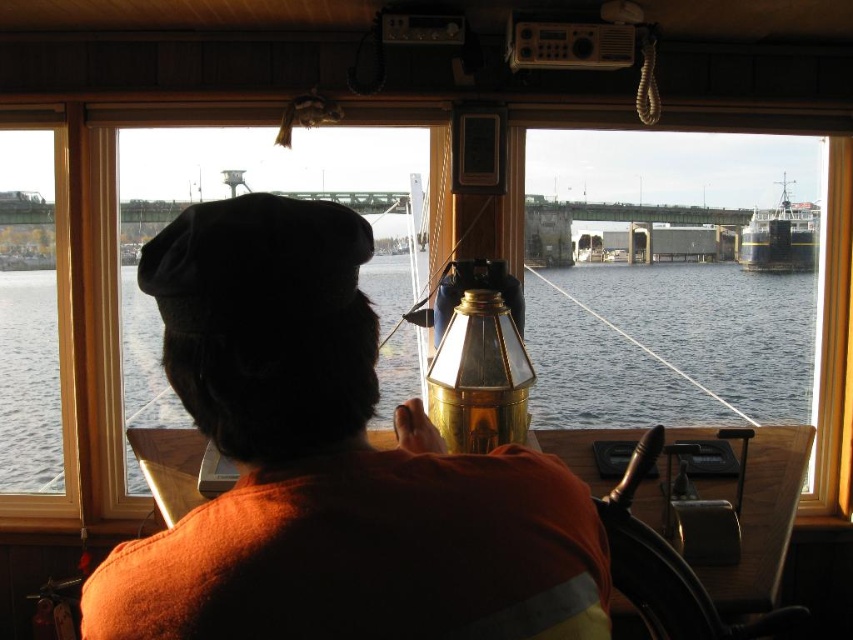
Question: Is transparent glass window at center closer to camera compared to dark blue metallic boat at upper right?

Choices:
 (A) yes
 (B) no

Answer: (A)

Question: Which object is positioned farthest from the orange fabric shirt at center?

Choices:
 (A) dark blue metallic boat at upper right
 (B) transparent glass window at center
 (C) clear water at center

Answer: (A)

Question: Can you confirm if orange fabric shirt at center is thinner than transparent glass window at center?

Choices:
 (A) yes
 (B) no

Answer: (B)

Question: Based on their relative distances, which object is nearer to the transparent glass window at center?

Choices:
 (A) clear water at center
 (B) dark blue metallic boat at upper right
 (C) orange fabric shirt at center

Answer: (C)

Question: Which object is closer to the camera taking this photo?

Choices:
 (A) transparent glass window at center
 (B) orange fabric shirt at center
 (C) clear water at center
 (D) dark blue metallic boat at upper right

Answer: (B)

Question: Is orange fabric shirt at center in front of transparent glass window at center?

Choices:
 (A) no
 (B) yes

Answer: (B)